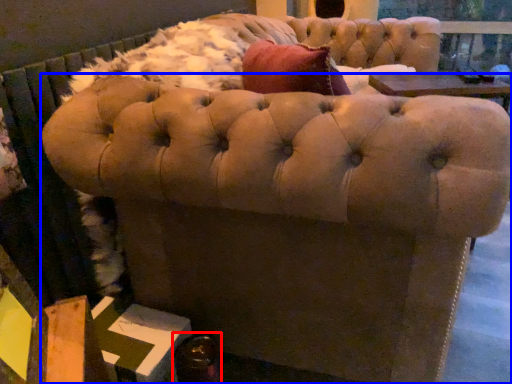
Question: Which object is closer to the camera taking this photo, bottle (highlighted by a red box) or furniture (highlighted by a blue box)?

Choices:
 (A) bottle
 (B) furniture

Answer: (B)